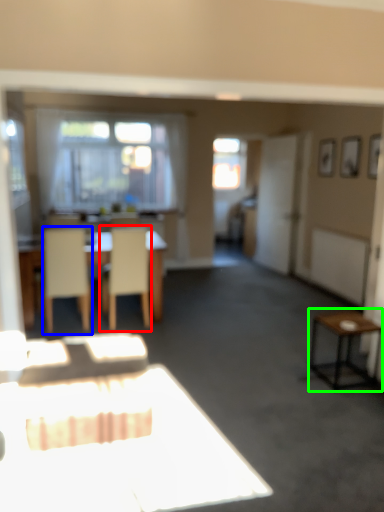
Question: Which object is the farthest from chair (highlighted by a red box)? Choose among these: chair (highlighted by a blue box) or side table (highlighted by a green box).

Choices:
 (A) chair
 (B) side table

Answer: (B)